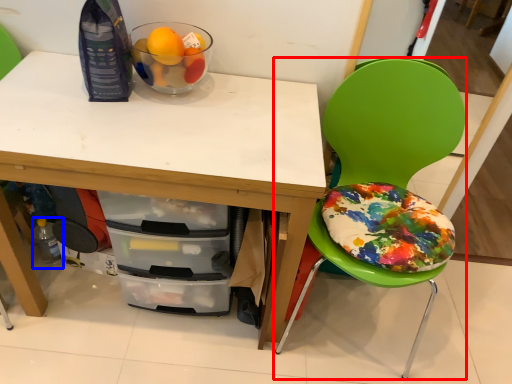
Question: Which object is further to the camera taking this photo, chair (highlighted by a red box) or bottle (highlighted by a blue box)?

Choices:
 (A) chair
 (B) bottle

Answer: (B)